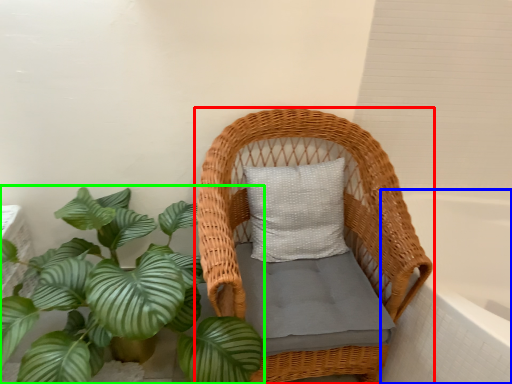
Question: Which is nearer to the furniture (highlighted by a red box)? bath (highlighted by a blue box) or houseplant (highlighted by a green box).

Choices:
 (A) bath
 (B) houseplant

Answer: (B)